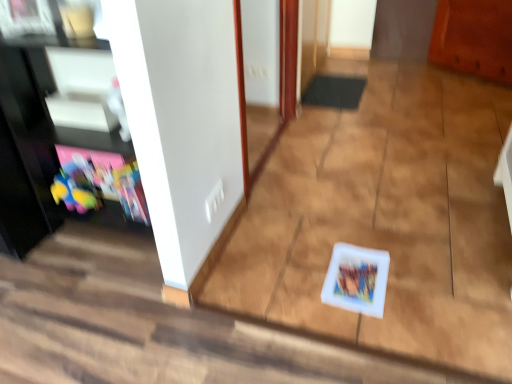
At what (x,y) coordinates should I click in order to perform the action: click on free space in front of black glossy entertainment center at left. Please return your answer as a coordinate pair (x, y). The height and width of the screenshot is (384, 512). Looking at the image, I should click on (81, 299).